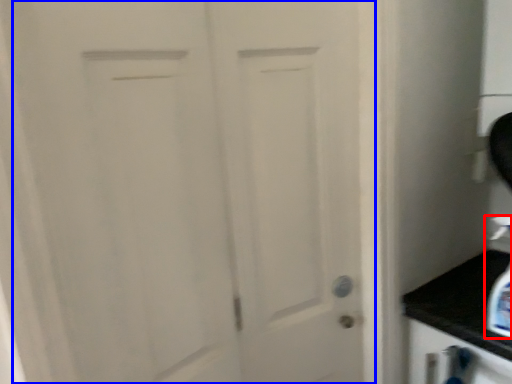
Question: Which object appears closest to the camera in this image, soap dispenser (highlighted by a red box) or door (highlighted by a blue box)?

Choices:
 (A) soap dispenser
 (B) door

Answer: (B)